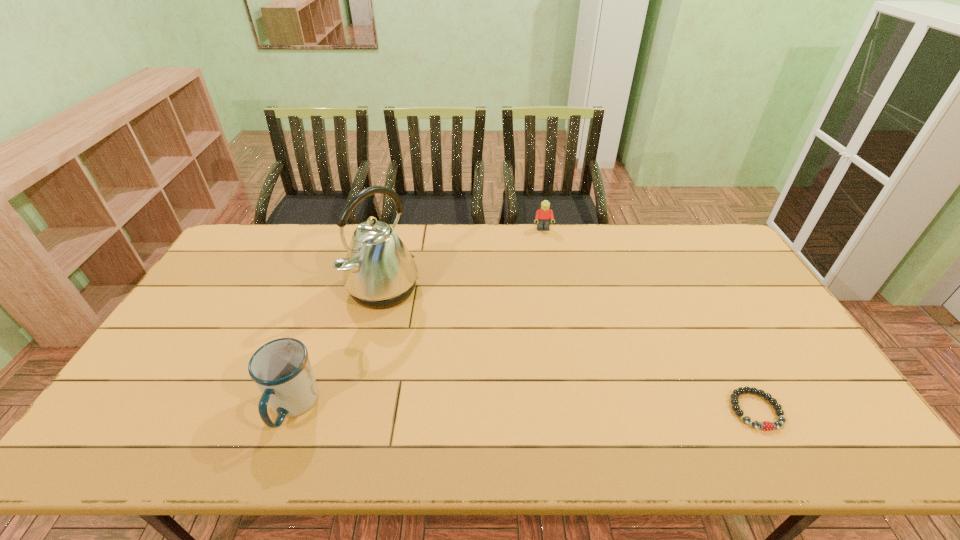
Identify the location of free spot on the desktop that is between the second tallest object and the rightmost object and is positioned on the face of the third object from left to right. The image size is (960, 540). (580, 409).

The image size is (960, 540). What are the coordinates of `free space on the desktop that is between the mug and the shortest object and is positioned from the spout of the tallest object` in the screenshot? It's located at (577, 409).